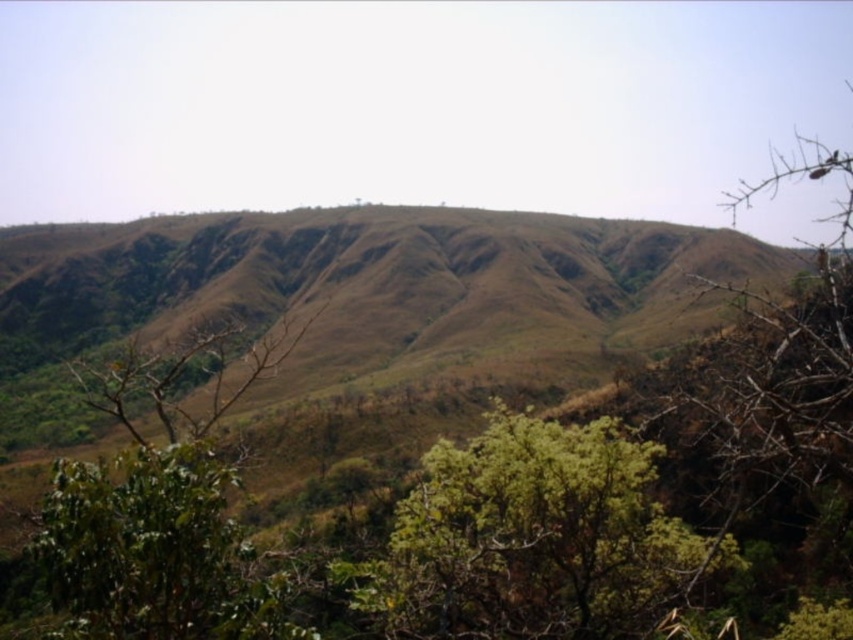
Question: Estimate the real-world distances between objects in this image. Which object is farther from the green leafy tree at lower left?

Choices:
 (A) green leafy tree at center
 (B) brown grassy hillside at center

Answer: (B)

Question: Is brown grassy hillside at center thinner than green leafy tree at center?

Choices:
 (A) no
 (B) yes

Answer: (A)

Question: Which object appears farthest from the camera in this image?

Choices:
 (A) brown grassy hillside at center
 (B) green leafy tree at lower left

Answer: (A)

Question: Which object is closer to the camera taking this photo?

Choices:
 (A) green leafy tree at lower left
 (B) green leafy tree at center
 (C) brown grassy hillside at center

Answer: (A)

Question: Does green leafy tree at center appear over green leafy tree at lower left?

Choices:
 (A) no
 (B) yes

Answer: (A)

Question: Can you confirm if green leafy tree at center is positioned to the left of green leafy tree at lower left?

Choices:
 (A) no
 (B) yes

Answer: (A)